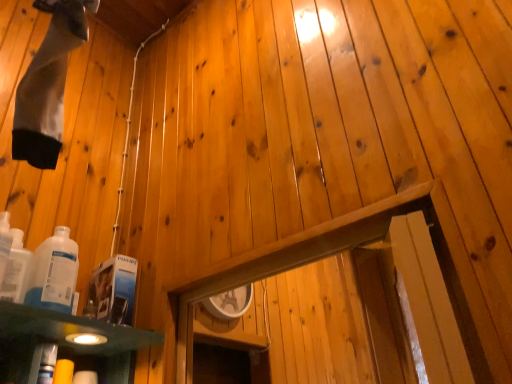
Question: Does white glossy bottle at lower left, which is the 1th bottle in right-to-left order, lie in front of white glossy bottle at lower left, which appears as the second bottle when viewed from the right?

Choices:
 (A) yes
 (B) no

Answer: (B)

Question: Can you confirm if white glossy bottle at lower left, the second bottle in the left-to-right sequence, is shorter than white glossy bottle at lower left, which appears as the second bottle when viewed from the right?

Choices:
 (A) yes
 (B) no

Answer: (B)

Question: From a real-world perspective, is white glossy bottle at lower left, the second bottle in the left-to-right sequence, positioned over white glossy bottle at lower left, which appears as the second bottle when viewed from the right, based on gravity?

Choices:
 (A) yes
 (B) no

Answer: (B)

Question: Is white glossy bottle at lower left, the second bottle in the left-to-right sequence, oriented away from white glossy bottle at lower left, placed as the 1th bottle when sorted from left to right?

Choices:
 (A) no
 (B) yes

Answer: (A)

Question: Would you say white glossy bottle at lower left, the second bottle in the left-to-right sequence, is outside white glossy bottle at lower left, which appears as the second bottle when viewed from the right?

Choices:
 (A) no
 (B) yes

Answer: (B)

Question: From the image's perspective, does white glossy bottle at lower left, which is the 1th bottle in right-to-left order, appear higher than white glossy bottle at lower left, which appears as the second bottle when viewed from the right?

Choices:
 (A) no
 (B) yes

Answer: (A)

Question: Considering the relative sizes of white glossy bottle at lower left, placed as the 1th bottle when sorted from left to right, and white glossy bottle at lower left, which is the 1th bottle in right-to-left order, in the image provided, is white glossy bottle at lower left, placed as the 1th bottle when sorted from left to right, thinner than white glossy bottle at lower left, which is the 1th bottle in right-to-left order,?

Choices:
 (A) yes
 (B) no

Answer: (A)

Question: Considering the relative sizes of white glossy bottle at lower left, which appears as the second bottle when viewed from the right, and white glossy bottle at lower left, the second bottle in the left-to-right sequence, in the image provided, is white glossy bottle at lower left, which appears as the second bottle when viewed from the right, bigger than white glossy bottle at lower left, the second bottle in the left-to-right sequence,?

Choices:
 (A) no
 (B) yes

Answer: (A)

Question: Is white glossy bottle at lower left, which appears as the second bottle when viewed from the right, oriented towards white glossy bottle at lower left, the second bottle in the left-to-right sequence?

Choices:
 (A) no
 (B) yes

Answer: (A)

Question: Can you confirm if white glossy bottle at lower left, placed as the 1th bottle when sorted from left to right, is wider than white glossy bottle at lower left, which is the 1th bottle in right-to-left order?

Choices:
 (A) no
 (B) yes

Answer: (A)

Question: From the image's perspective, is white glossy bottle at lower left, which appears as the second bottle when viewed from the right, beneath white glossy bottle at lower left, the second bottle in the left-to-right sequence?

Choices:
 (A) yes
 (B) no

Answer: (B)

Question: Can you confirm if white glossy bottle at lower left, placed as the 1th bottle when sorted from left to right, is taller than white glossy bottle at lower left, the second bottle in the left-to-right sequence?

Choices:
 (A) yes
 (B) no

Answer: (B)

Question: Looking at the image, does white glossy bottle at lower left, the second bottle in the left-to-right sequence, seem bigger or smaller compared to white glossy bottle at lower left, which appears as the second bottle when viewed from the right?

Choices:
 (A) small
 (B) big

Answer: (B)